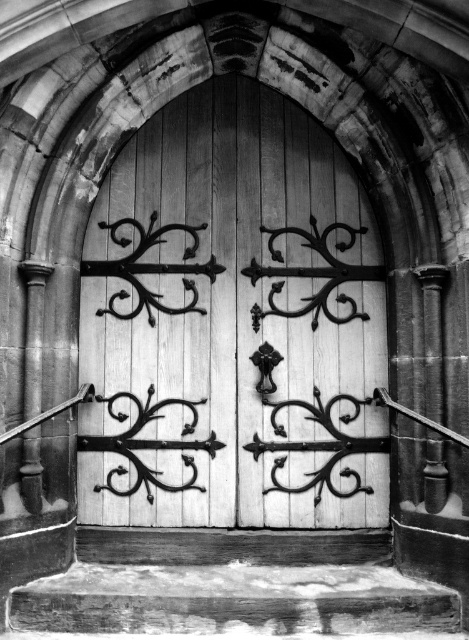
Question: From the image, what is the correct spatial relationship of white wood door at center in relation to wooden at lower center?

Choices:
 (A) right
 (B) left

Answer: (A)

Question: Among these points, which one is nearest to the camera?

Choices:
 (A) (249, 468)
 (B) (320, 621)

Answer: (B)

Question: Is white wood door at center above wooden at lower center?

Choices:
 (A) no
 (B) yes

Answer: (B)

Question: Can you confirm if white wood door at center is positioned to the left of wooden at lower center?

Choices:
 (A) no
 (B) yes

Answer: (A)